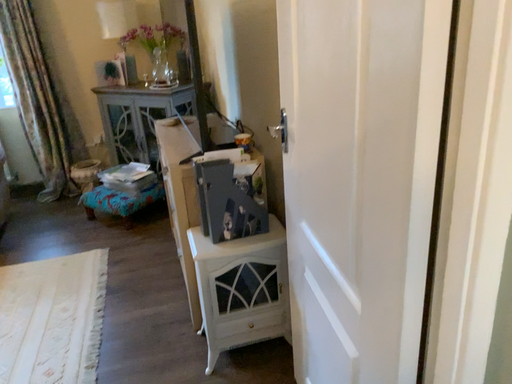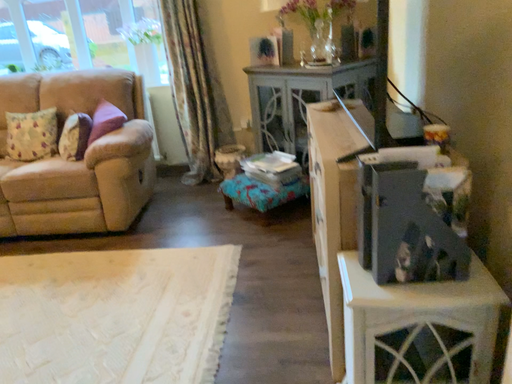
Question: Which way did the camera rotate in the video?

Choices:
 (A) rotated left
 (B) rotated right

Answer: (A)